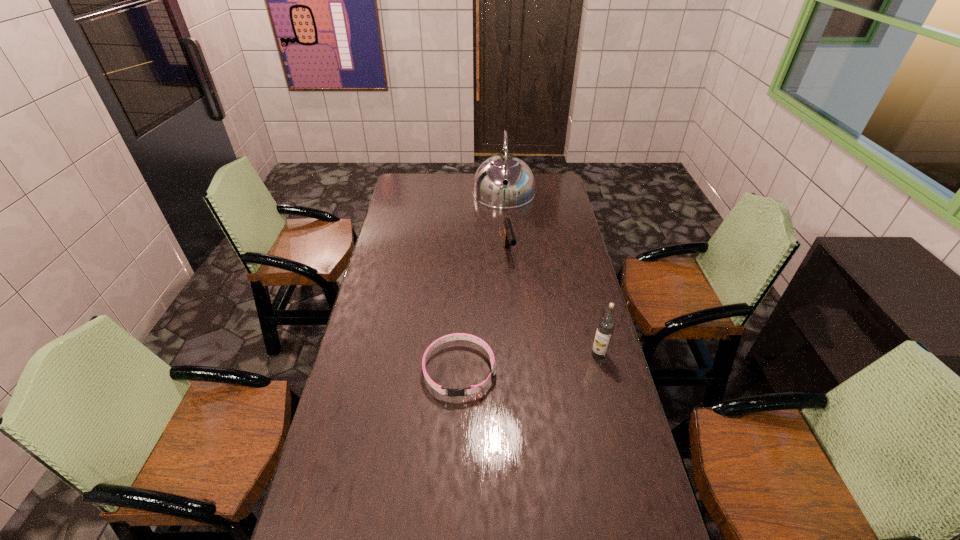
This screenshot has height=540, width=960. Find the location of `free spot located on the label of the rightmost object`. free spot located on the label of the rightmost object is located at coordinates (518, 355).

At what (x,y) coordinates should I click in order to perform the action: click on free space located at the barrel of the second farthest object. Please return your answer as a coordinate pair (x, y). The height and width of the screenshot is (540, 960). Looking at the image, I should click on pos(523,315).

Where is `vacant space situated at the barrel of the second farthest object`? The width and height of the screenshot is (960, 540). vacant space situated at the barrel of the second farthest object is located at coordinates (514, 280).

Where is `vacant space located 0.240m at the barrel of the second farthest object`? vacant space located 0.240m at the barrel of the second farthest object is located at coordinates (520, 306).

I want to click on free region located from the spout of the tallest object, so click(x=506, y=240).

Identify the location of vacant space located 0.390m from the spout of the tallest object. This screenshot has width=960, height=540. (507, 263).

I want to click on vacant space located from the spout of the tallest object, so click(506, 238).

Find the location of a particular element. The width and height of the screenshot is (960, 540). object positioned at the far edge is located at coordinates (489, 189).

What are the coordinates of `vodka that is at the right edge` in the screenshot? It's located at (606, 325).

Identify the location of kettle located in the right edge section of the desktop. (489, 189).